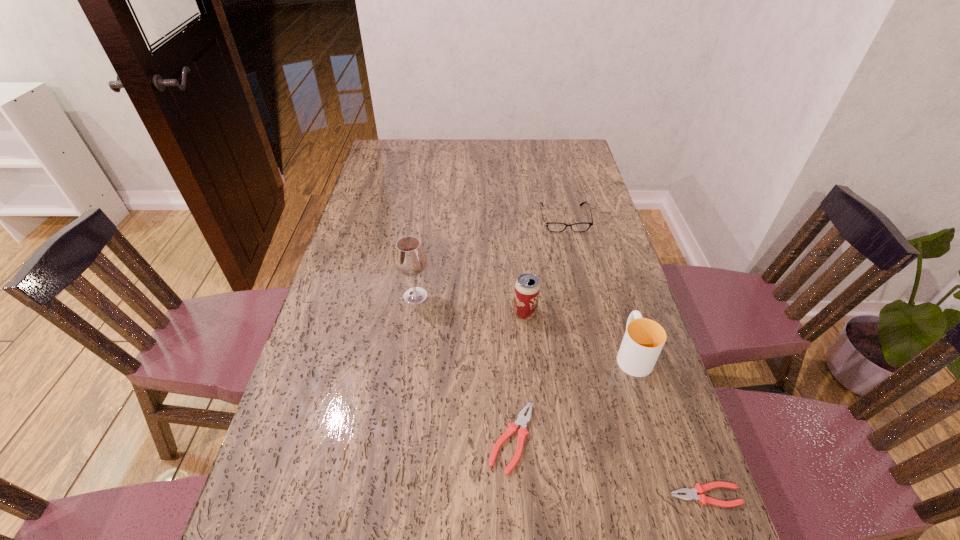
You are a GUI agent. You are given a task and a screenshot of the screen. Output one action in this format:
    pyautogui.click(x=<x>, y=<y>)
    Task: Click on the taller pliers
    The image size is (960, 540).
    Given the screenshot: What is the action you would take?
    pyautogui.click(x=522, y=420)

The height and width of the screenshot is (540, 960). What are the coordinates of `the fifth tallest object` in the screenshot? It's located at click(x=522, y=420).

The image size is (960, 540). In order to click on the nearer pliers in this screenshot , I will do `click(691, 494)`.

Locate an element on the screen. The image size is (960, 540). the nearest object is located at coordinates (691, 494).

Find the location of a particular element. The width and height of the screenshot is (960, 540). the third shortest object is located at coordinates (551, 226).

The image size is (960, 540). What are the coordinates of `spectacles` in the screenshot? It's located at (551, 226).

The height and width of the screenshot is (540, 960). I want to click on the third nearest object, so click(x=644, y=339).

The height and width of the screenshot is (540, 960). Identify the location of wineglass. (410, 259).

You are a GUI agent. You are given a task and a screenshot of the screen. Output one action in this format:
    pyautogui.click(x=<x>, y=<y>)
    Task: Click on the tallest object
    
    Given the screenshot: What is the action you would take?
    [x=410, y=259]

Where is `beer can`? beer can is located at coordinates (527, 287).